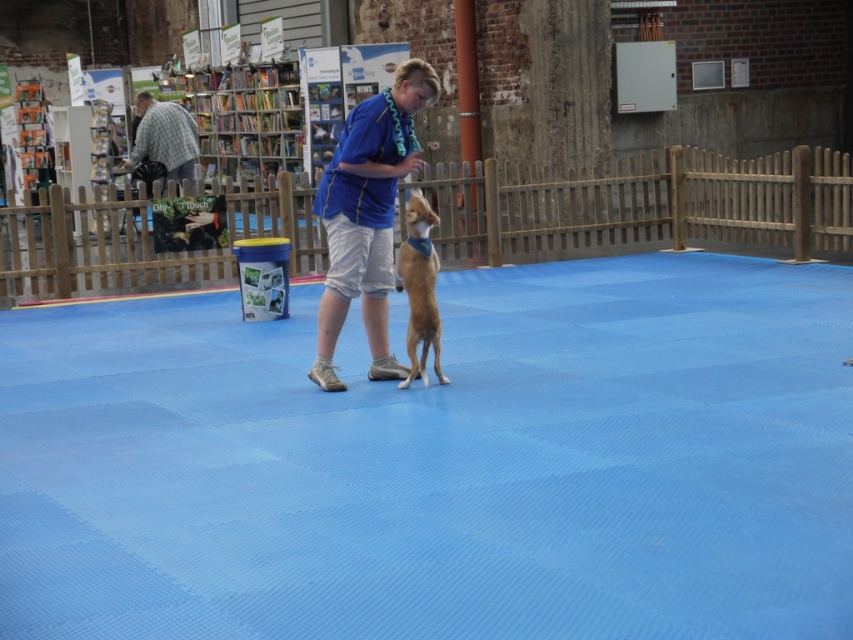
You are standing in the scene and need to find the blue fabric shirt at center and the checkered fabric shirt at left. Which one is lower in position?

The blue fabric shirt at center is located below the checkered fabric shirt at left, so the blue fabric shirt at center is lower.

You are organizing a clothing drive and need to sort shirts by size. You have a blue fabric shirt at center and a checkered fabric shirt at left. Which shirt should you place in the large size bin?

The blue fabric shirt at center should be placed in the large size bin because it has a larger size compared to the checkered fabric shirt at left.